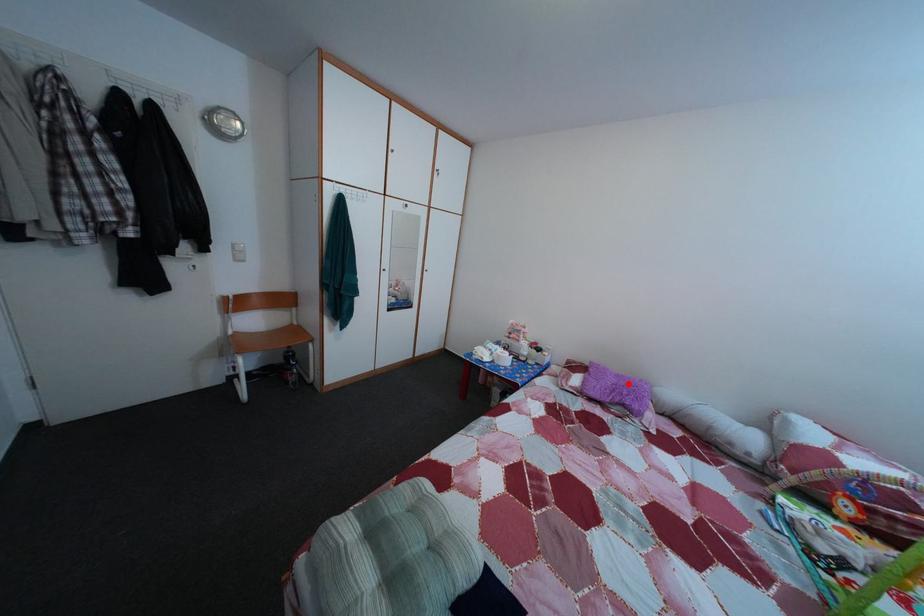
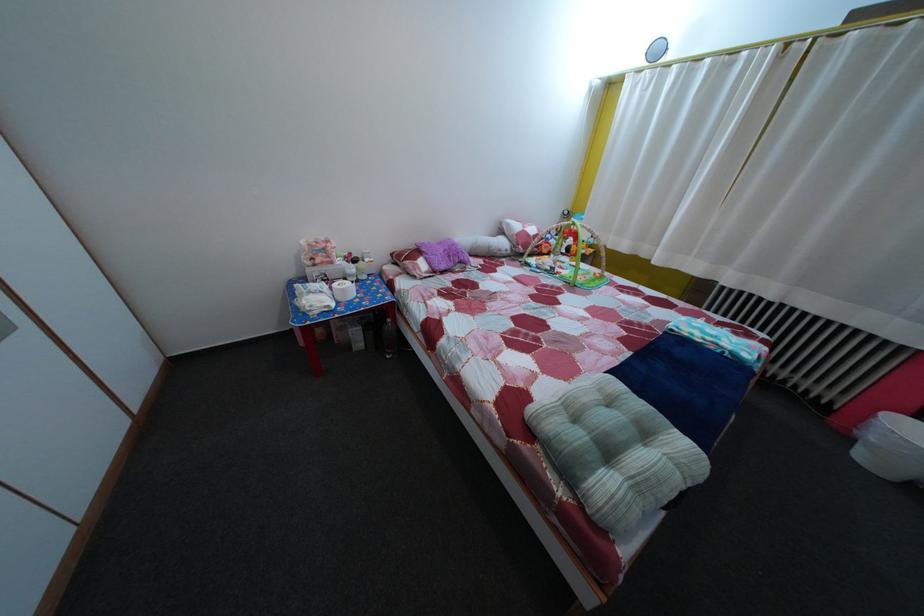
The point at the highlighted location is marked in the first image. Where is the corresponding point in the second image?

(450, 252)